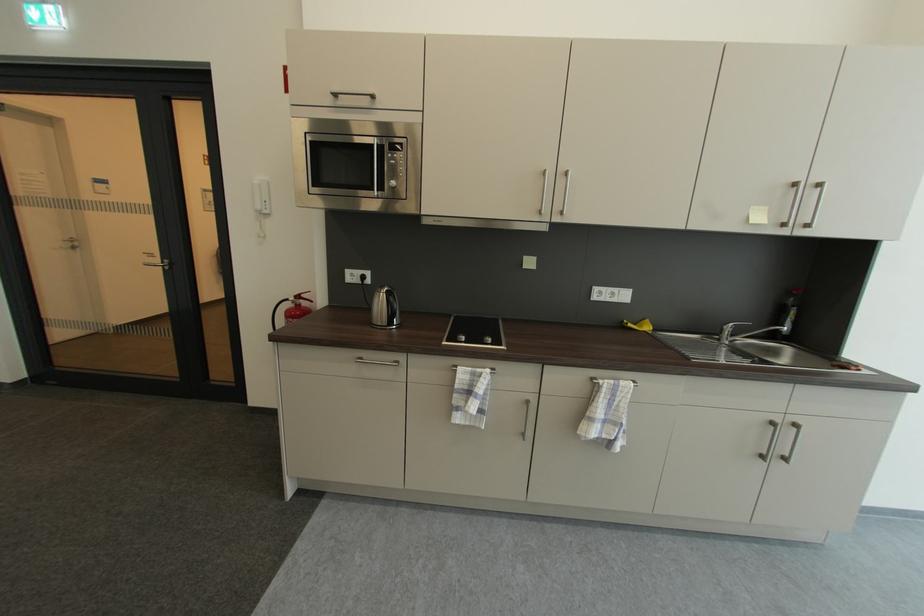
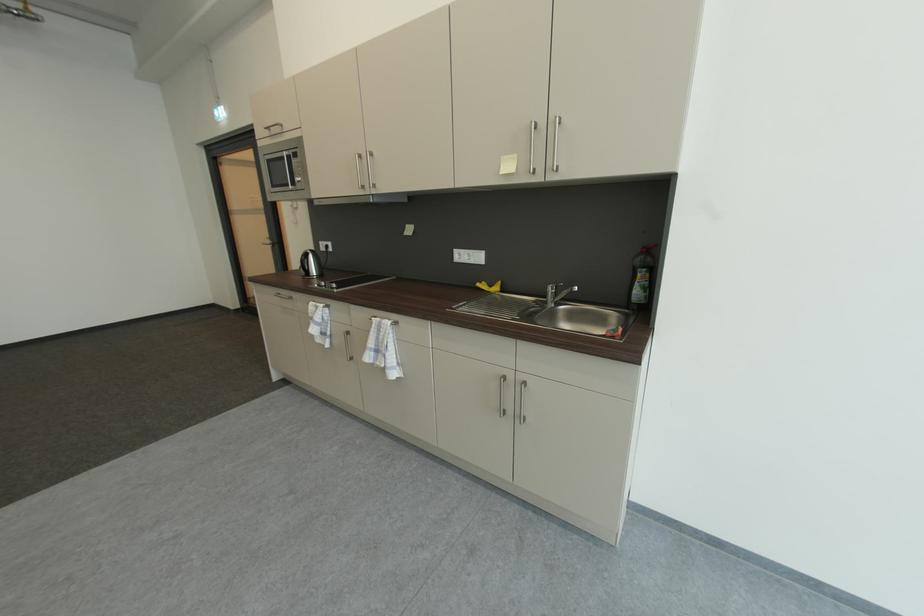
The point at (x=725, y=341) is marked in the first image. Where is the corresponding point in the second image?

(553, 304)